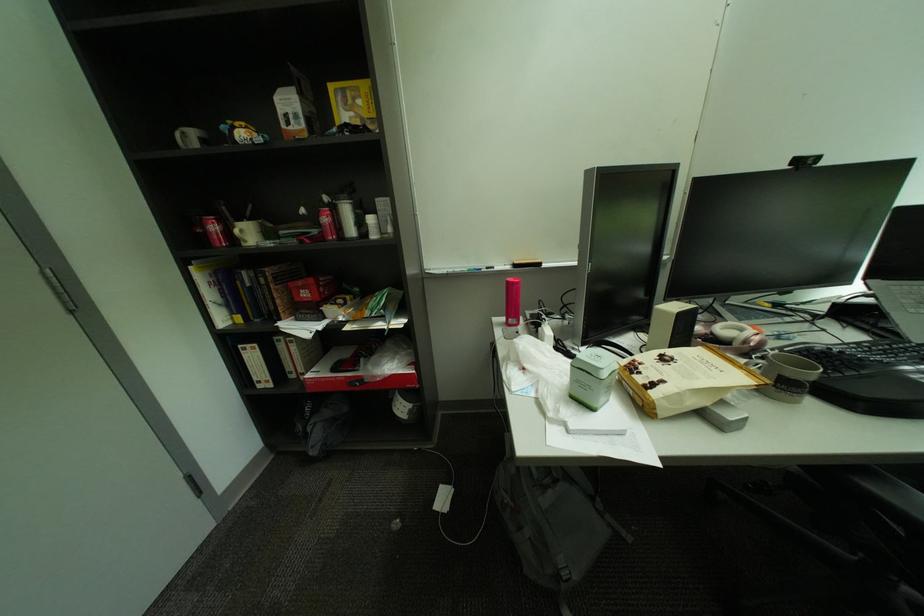
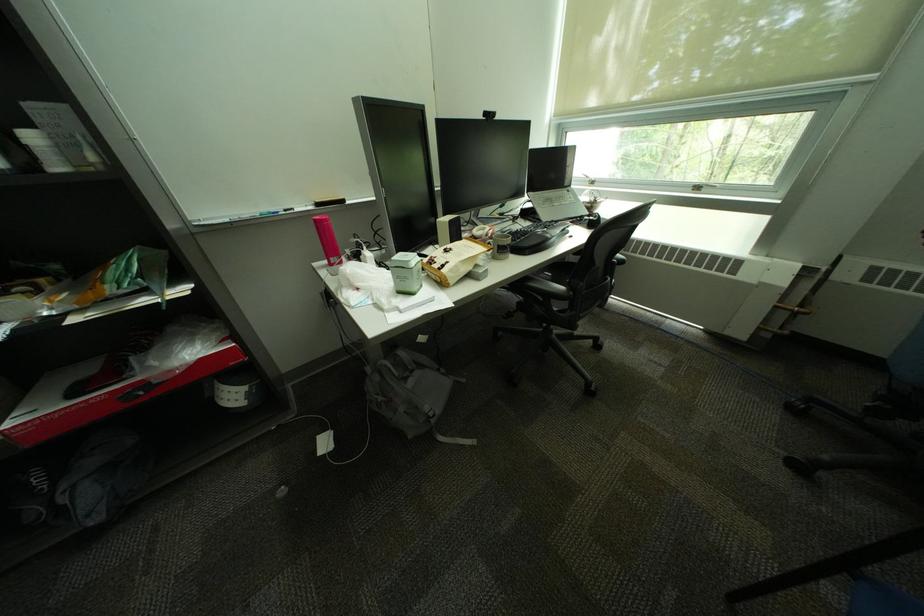
Question: The camera is either moving clockwise (left) or counter-clockwise (right) around the object. The first image is from the beginning of the video and the second image is from the end. Is the camera moving left or right when shooting the video?

Choices:
 (A) Left
 (B) Right

Answer: (A)